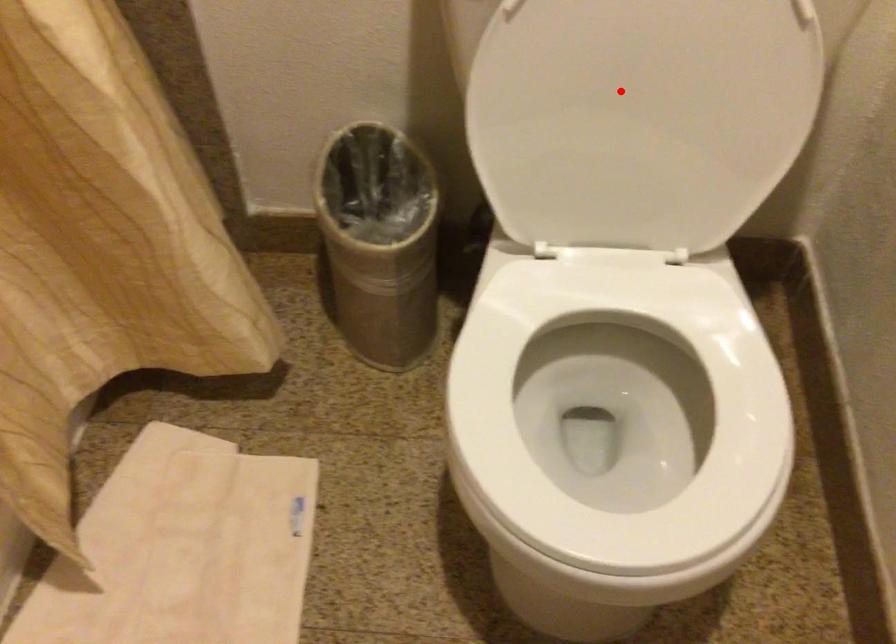
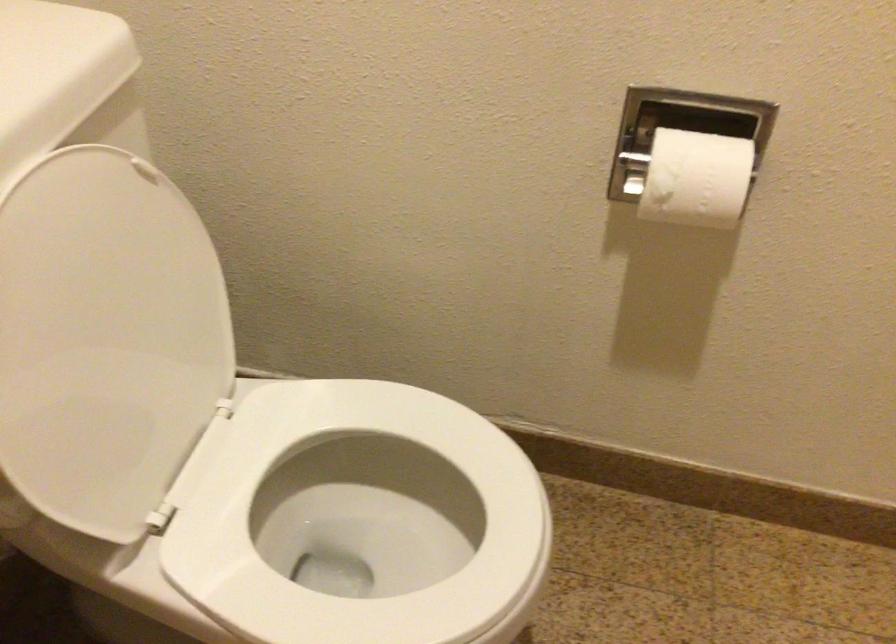
Locate, in the second image, the point that corresponds to the highlighted location in the first image.

(105, 339)